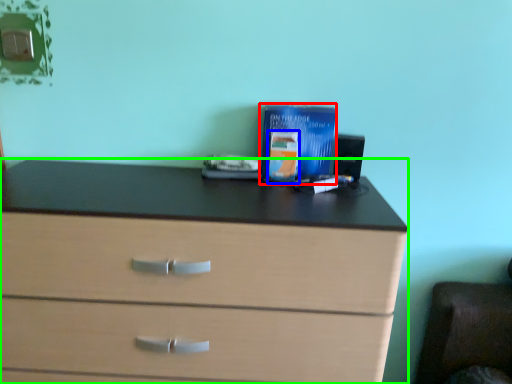
Question: Based on their relative distances, which object is nearer to paperback book (highlighted by a red box)? Choose from paperback book (highlighted by a blue box) and chest of drawers (highlighted by a green box).

Choices:
 (A) paperback book
 (B) chest of drawers

Answer: (A)